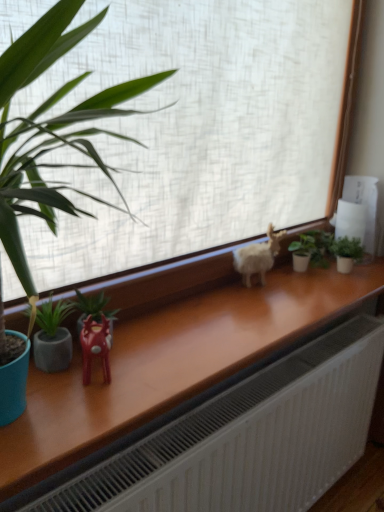
Question: Considering the relative positions of green matte plant at right, which is the 3th houseplant from front to back, and white fluffy goat at center in the image provided, is green matte plant at right, which is the 3th houseplant from front to back, behind white fluffy goat at center?

Choices:
 (A) no
 (B) yes

Answer: (B)

Question: Is green matte plant at right, the fourth houseplant in the left-to-right sequence, positioned with its back to white fluffy goat at center?

Choices:
 (A) yes
 (B) no

Answer: (B)

Question: Is white fluffy goat at center a part of green matte plant at right, acting as the second houseplant starting from the back?

Choices:
 (A) yes
 (B) no

Answer: (B)

Question: Considering the relative positions of green matte plant at right, acting as the second houseplant starting from the back, and white fluffy goat at center in the image provided, is green matte plant at right, acting as the second houseplant starting from the back, to the left of white fluffy goat at center from the viewer's perspective?

Choices:
 (A) yes
 (B) no

Answer: (B)

Question: Considering the relative sizes of green matte plant at right, the fourth houseplant in the left-to-right sequence, and white fluffy goat at center in the image provided, is green matte plant at right, the fourth houseplant in the left-to-right sequence, shorter than white fluffy goat at center?

Choices:
 (A) yes
 (B) no

Answer: (A)

Question: In terms of height, does green matte plant at left, marked as the 1th houseplant in a front-to-back arrangement, look taller or shorter compared to white matte window at center?

Choices:
 (A) short
 (B) tall

Answer: (A)

Question: In terms of size, does green matte plant at left, which is counted as the 1th houseplant, starting from the left, appear bigger or smaller than white matte window at center?

Choices:
 (A) big
 (B) small

Answer: (B)

Question: From a real-world perspective, is green matte plant at left, which is counted as the 1th houseplant, starting from the left, above or below white matte window at center?

Choices:
 (A) above
 (B) below

Answer: (B)

Question: Considering the positions of green matte plant at left, which is counted as the 1th houseplant, starting from the left, and white matte window at center in the image, is green matte plant at left, which is counted as the 1th houseplant, starting from the left, wider or thinner than white matte window at center?

Choices:
 (A) thin
 (B) wide

Answer: (A)

Question: Based on their sizes in the image, would you say green matte plant at right, the fourth houseplant in the left-to-right sequence, is bigger or smaller than green matte plant at left, placed as the 4th houseplant when sorted from back to front?

Choices:
 (A) big
 (B) small

Answer: (B)

Question: Considering the positions of green matte plant at right, acting as the second houseplant starting from the back, and green matte plant at left, placed as the 4th houseplant when sorted from back to front, in the image, is green matte plant at right, acting as the second houseplant starting from the back, taller or shorter than green matte plant at left, placed as the 4th houseplant when sorted from back to front,?

Choices:
 (A) tall
 (B) short

Answer: (B)

Question: Considering the positions of green matte plant at right, the 1th houseplant viewed from the right, and green matte plant at left, marked as the 1th houseplant in a front-to-back arrangement, in the image, is green matte plant at right, the 1th houseplant viewed from the right, wider or thinner than green matte plant at left, marked as the 1th houseplant in a front-to-back arrangement,?

Choices:
 (A) wide
 (B) thin

Answer: (A)

Question: Visually, is green matte plant at right, the 1th houseplant viewed from the right, positioned to the left or to the right of green matte plant at left, which is counted as the 1th houseplant, starting from the left?

Choices:
 (A) left
 (B) right

Answer: (B)

Question: Based on their positions, is shiny red plastic reindeer at center-left located to the left or right of green matte plant at left, marked as the 1th houseplant in a front-to-back arrangement?

Choices:
 (A) left
 (B) right

Answer: (B)

Question: Looking at the image, does shiny red plastic reindeer at center-left seem bigger or smaller compared to green matte plant at left, marked as the 1th houseplant in a front-to-back arrangement?

Choices:
 (A) big
 (B) small

Answer: (B)